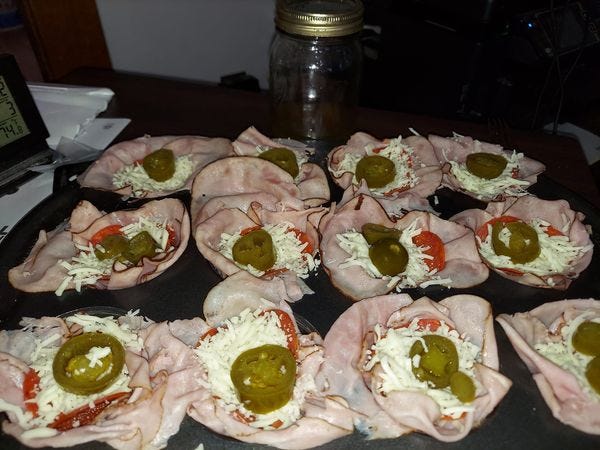
This screenshot has width=600, height=450. Identify the location of white painted wall. (205, 15).